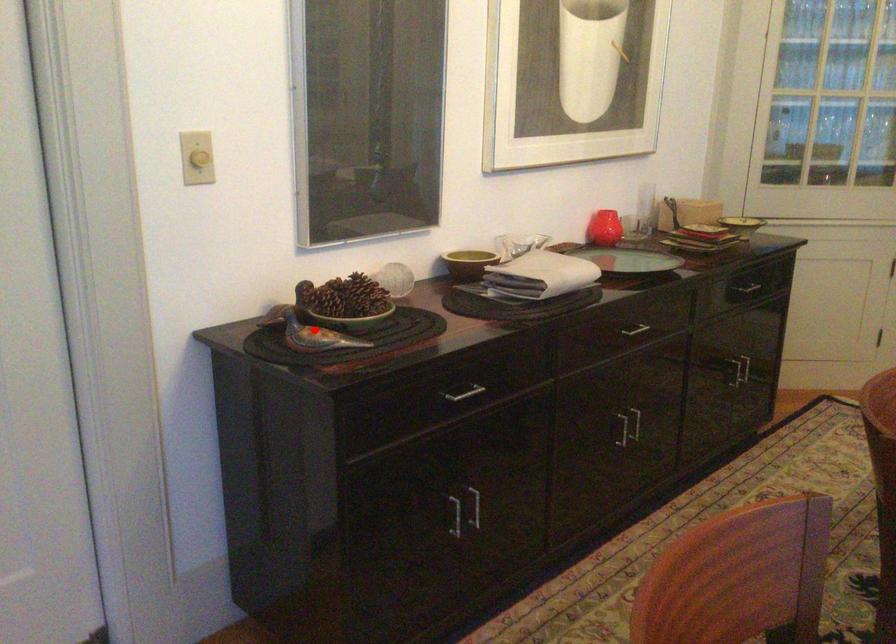
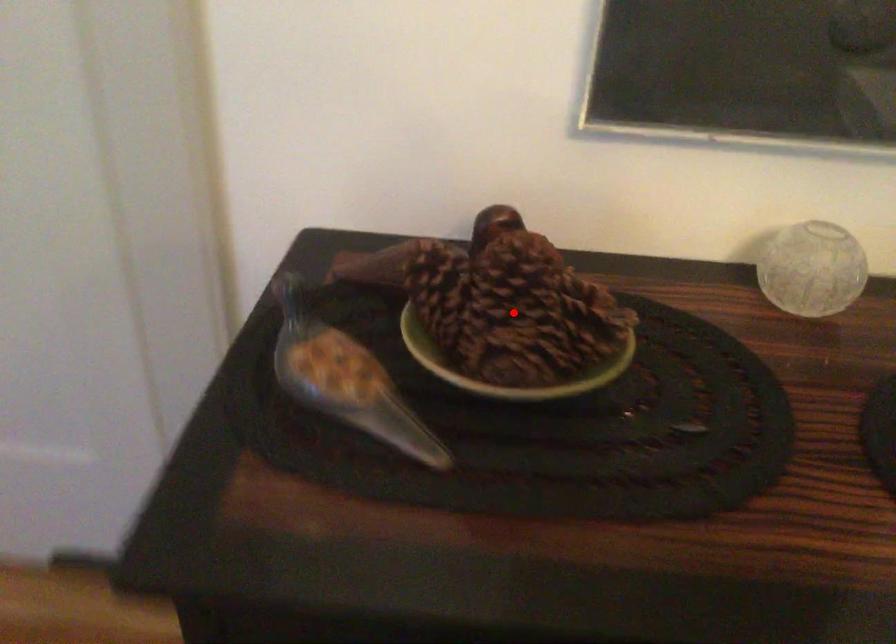
I am providing you with two images of the same scene from different viewpoints. A red point is marked on the first image and another point is marked on the second image. Is the red point in image1 aligned with the point shown in image2?

No